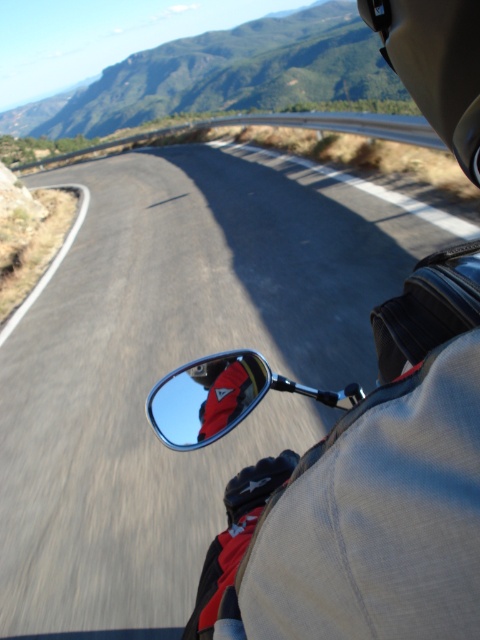
Question: Among these objects, which one is farthest from the camera?

Choices:
 (A) polished chrome mirror at lower center
 (B) red leather glove at side mirror

Answer: (B)

Question: Does polished chrome mirror at lower center appear on the right side of red leather glove at side mirror?

Choices:
 (A) no
 (B) yes

Answer: (A)

Question: Is polished chrome mirror at lower center further to the viewer compared to red leather glove at side mirror?

Choices:
 (A) no
 (B) yes

Answer: (A)

Question: Does polished chrome mirror at lower center lie in front of red leather glove at side mirror?

Choices:
 (A) no
 (B) yes

Answer: (B)